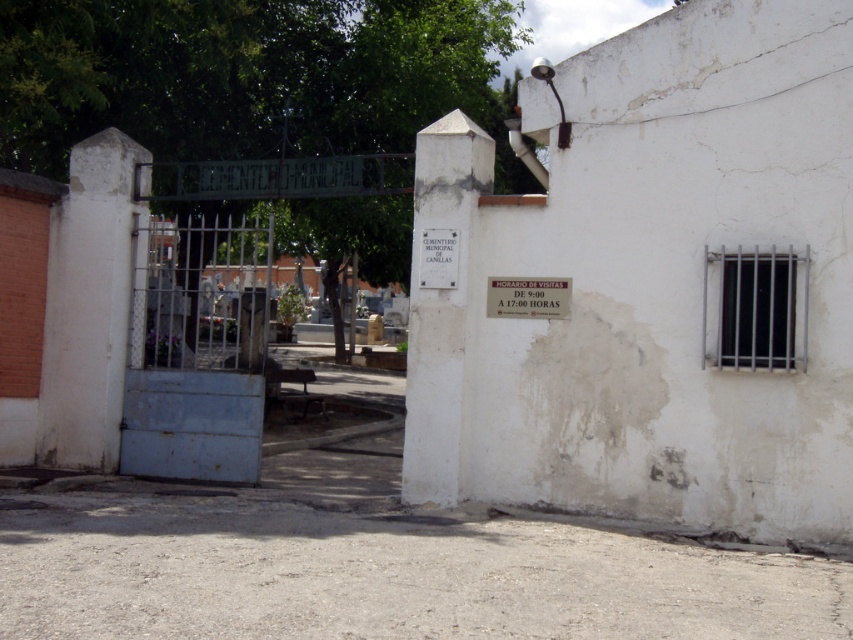
Is rusty metal gate at center taller than white paper sign at upper center?

Yes, rusty metal gate at center is taller than white paper sign at upper center.

Is point (264, 244) positioned behind point (554, 296)?

Yes, it is.

Locate an element on the screen. This screenshot has width=853, height=640. rusty metal gate at center is located at coordinates (202, 294).